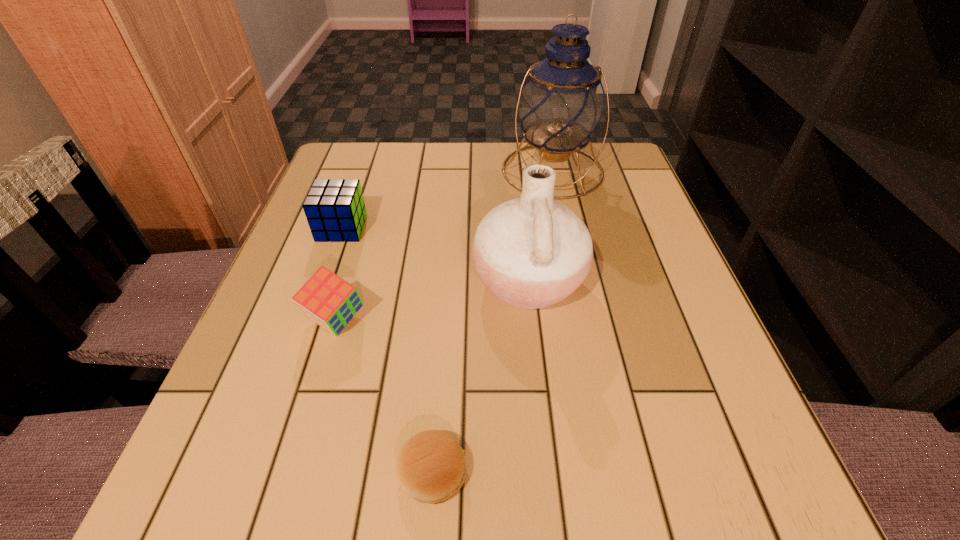
The width and height of the screenshot is (960, 540). In order to click on the farthest object in this screenshot , I will do `click(561, 104)`.

Where is `lantern`? This screenshot has height=540, width=960. lantern is located at coordinates (561, 104).

Identify the location of the fourth shortest object. The width and height of the screenshot is (960, 540). (531, 252).

Find the location of `the nearer cube`. the nearer cube is located at coordinates (331, 302).

You are a GUI agent. You are given a task and a screenshot of the screen. Output one action in this format:
    pyautogui.click(x=<x>, y=<y>)
    Task: Click on the fourth nearest object
    Image resolution: width=960 pixels, height=540 pixels.
    Given the screenshot: What is the action you would take?
    pyautogui.click(x=335, y=209)

What are the coordinates of `the shortest object` in the screenshot? It's located at (x=431, y=467).

Where is `the third object from left to right`? The height and width of the screenshot is (540, 960). the third object from left to right is located at coordinates (431, 467).

Identify the location of vacant region located 0.180m on the front-facing side of the farthest object. (569, 252).

Where is `vacant space located 0.240m to pour from the handle of the second tallest object`? The width and height of the screenshot is (960, 540). vacant space located 0.240m to pour from the handle of the second tallest object is located at coordinates (346, 281).

Where is `vacant space located to pour from the handle of the second tallest object`? Image resolution: width=960 pixels, height=540 pixels. vacant space located to pour from the handle of the second tallest object is located at coordinates (334, 281).